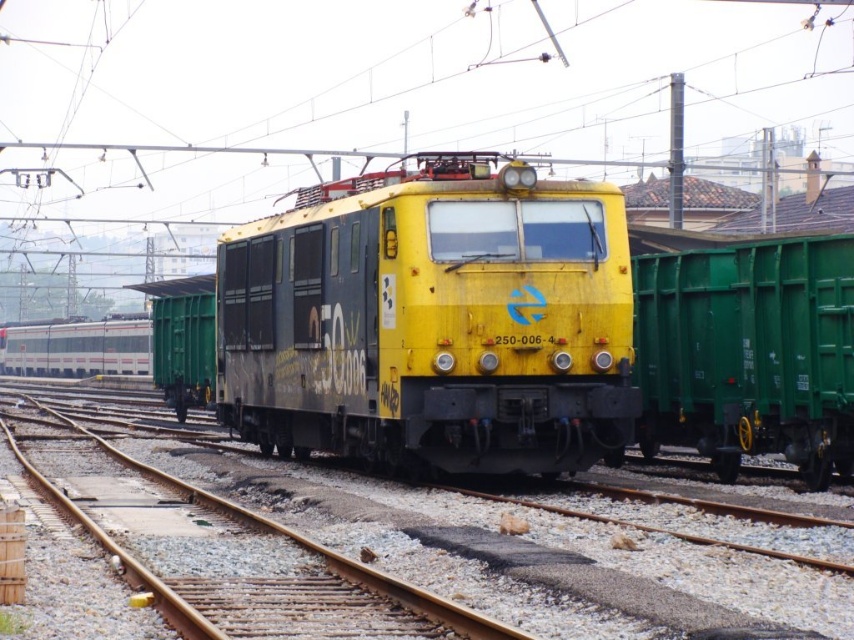
You are a railway inspector checking the dimensions of the yellow matte train at center and the green matte freight car at right. According to the scene, which object has a greater width?

The yellow matte train at center has a greater width than the green matte freight car at right.

From the picture: You are standing in the railway yard and want to know which of the two points, point (402, 237) or point (816, 460), is closer to you. Based on the scene, can you determine which one is nearer?

Point (402, 237) is closer to the camera than point (816, 460), so it is nearer to you.

You are a railway engineer inspecting the train layout. You need to determine if the yellow matte train at center can pull the green matte freight car at right. Based on their sizes, what do you conclude?

The yellow matte train at center is larger in size than the green matte freight car at right, so it is capable of pulling the freight car as larger locomotives typically have greater pulling power.